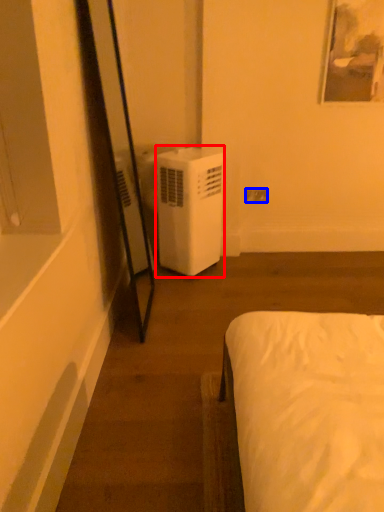
Question: Among these objects, which one is nearest to the camera, air conditioner (highlighted by a red box) or electric outlet (highlighted by a blue box)?

Choices:
 (A) air conditioner
 (B) electric outlet

Answer: (A)